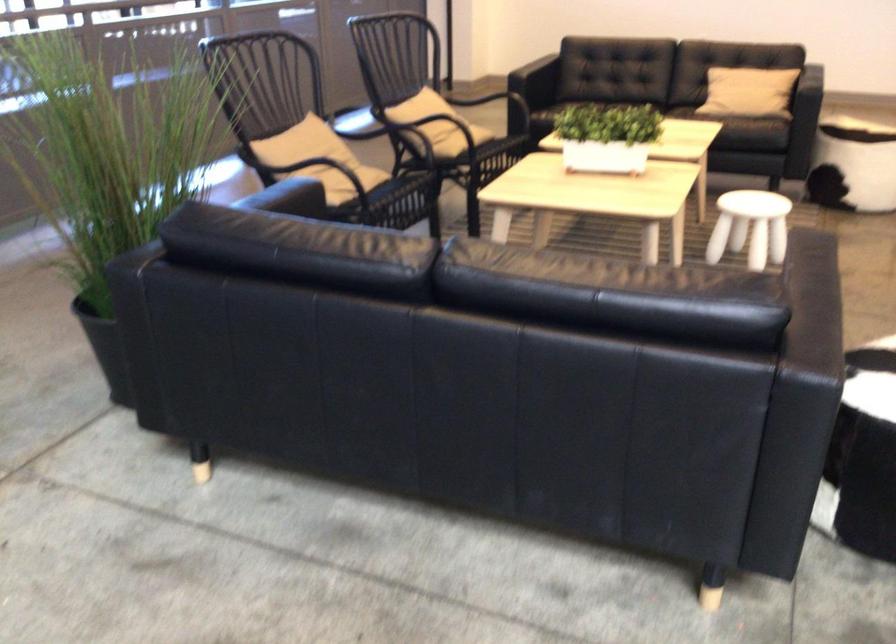
Where is `beige throw pillow`? This screenshot has width=896, height=644. beige throw pillow is located at coordinates pyautogui.click(x=308, y=153).